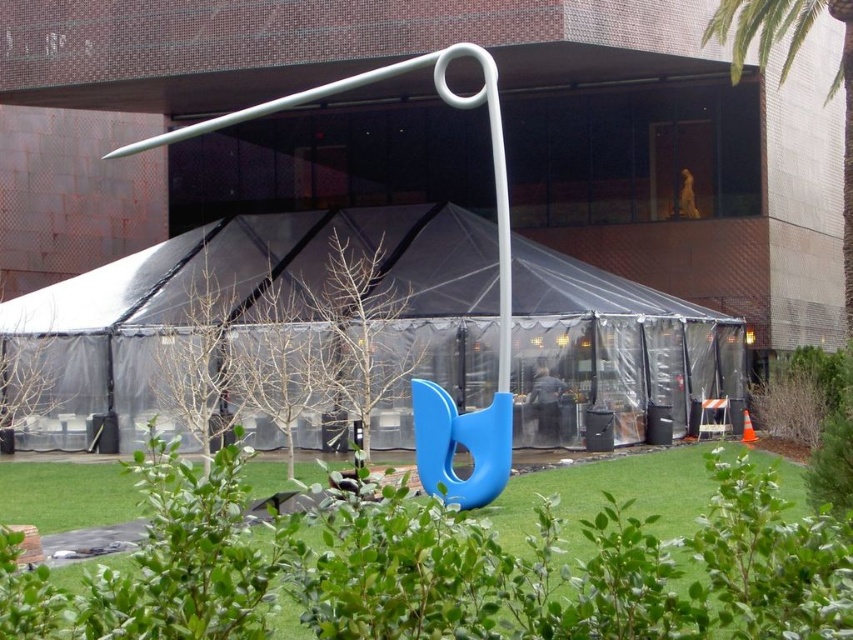
Is green grass at center shorter than green leafy bush at lower right?

Indeed, green grass at center has a lesser height compared to green leafy bush at lower right.

Describe the element at coordinates (448, 570) in the screenshot. I see `green grass at center` at that location.

Measure the distance between green grass at center and camera.

They are 2.76 meters apart.

Where is `green grass at center`? Image resolution: width=853 pixels, height=640 pixels. green grass at center is located at coordinates (448, 570).

Is transparent plastic tent at center positioned in front of green leafy bush at lower right?

No, it is not.

Who is lower down, transparent plastic tent at center or green leafy bush at lower right?

green leafy bush at lower right

Where is `transparent plastic tent at center`? The height and width of the screenshot is (640, 853). transparent plastic tent at center is located at coordinates (265, 324).

What do you see at coordinates (265, 324) in the screenshot?
I see `transparent plastic tent at center` at bounding box center [265, 324].

Is transparent plastic tent at center bigger than green grass at center?

Correct, transparent plastic tent at center is larger in size than green grass at center.

What do you see at coordinates (265, 324) in the screenshot?
I see `transparent plastic tent at center` at bounding box center [265, 324].

At what (x,y) coordinates should I click in order to perform the action: click on transparent plastic tent at center. Please return your answer as a coordinate pair (x, y). Looking at the image, I should click on (265, 324).